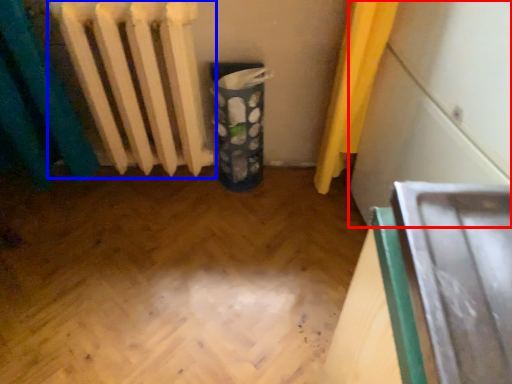
Question: Which point is further to the camera, wide (highlighted by a red box) or radiator (highlighted by a blue box)?

Choices:
 (A) wide
 (B) radiator

Answer: (B)